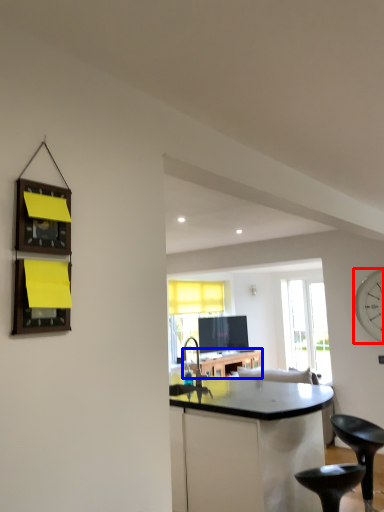
Question: Which object appears farthest to the camera in this image, clock (highlighted by a red box) or table (highlighted by a blue box)?

Choices:
 (A) clock
 (B) table

Answer: (B)